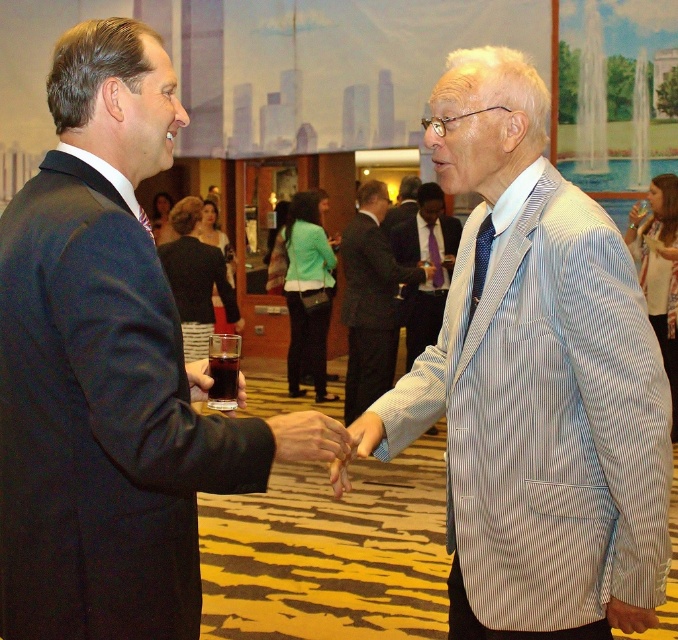
Question: Is matte black suit at center below light blue striped blazer at center?

Choices:
 (A) no
 (B) yes

Answer: (B)

Question: Which point is closer to the camera taking this photo?

Choices:
 (A) (115, 243)
 (B) (203, 369)

Answer: (A)

Question: Which point is closer to the camera taking this photo?

Choices:
 (A) (239, 385)
 (B) (357, 241)
 (C) (222, 464)

Answer: (C)

Question: Which of the following is the farthest from the observer?

Choices:
 (A) (540, 198)
 (B) (199, 400)
 (C) (426, 253)
 (D) (174, 340)

Answer: (C)

Question: Is the position of light blue striped blazer at center less distant than that of striped cotton blazer at center?

Choices:
 (A) no
 (B) yes

Answer: (B)

Question: Is matte black suit at center thinner than translucent glass at center?

Choices:
 (A) yes
 (B) no

Answer: (B)